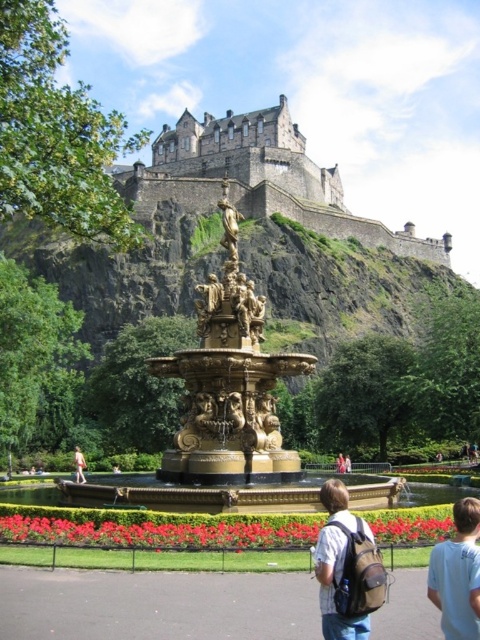
You are standing at the base of the grand ornate fountain in the park. You want to find the point at point (x=259, y=179). Which direction should you look to find it?

You should look towards the brown stone castle at upper center because the point (x=259, y=179) is located there.

You are standing in the park and want to take a photo of the point at coordinates (470,602). Your camera has a maximum zoom range of 40 feet. Can you capture the point without moving closer?

The point at coordinates (470,602) is 50.01 feet away from the viewer. Since the camera can only zoom up to 40 feet, you cannot capture the point without moving closer.

You are a photographer planning to take a photo of the white cotton shirt at lower right and the light brown wooden bench at center. Which object should you focus on first if you want to capture both in sharp focus?

The light brown wooden bench at center should be focused on first because it is closer to the viewer than the white cotton shirt at lower right, which is located above it.